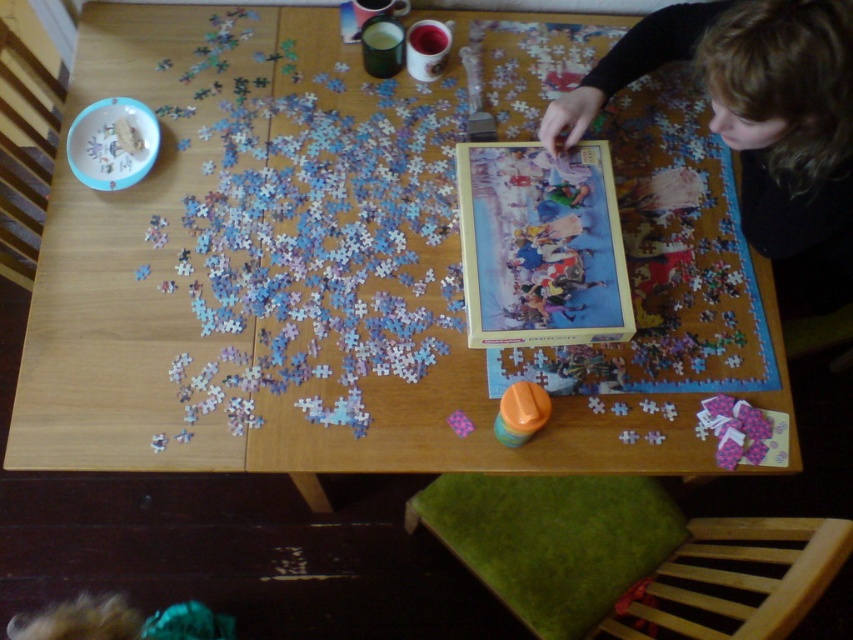
Can you confirm if wooden table at center is positioned to the left of blonde hair at upper right?

Yes, wooden table at center is to the left of blonde hair at upper right.

Does wooden table at center have a greater height compared to blonde hair at upper right?

Yes, wooden table at center is taller than blonde hair at upper right.

Where is `wooden table at center`? Image resolution: width=853 pixels, height=640 pixels. wooden table at center is located at coordinates (289, 280).